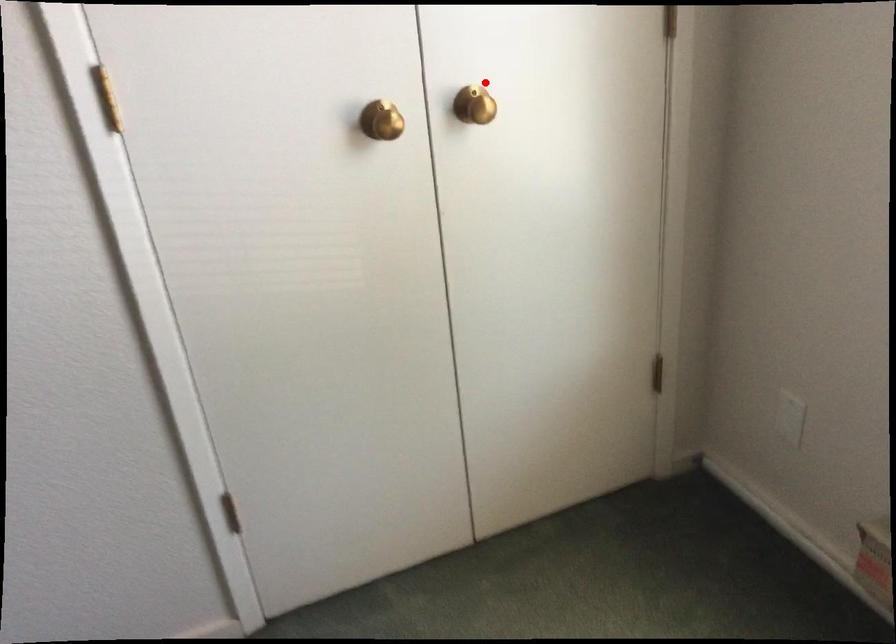
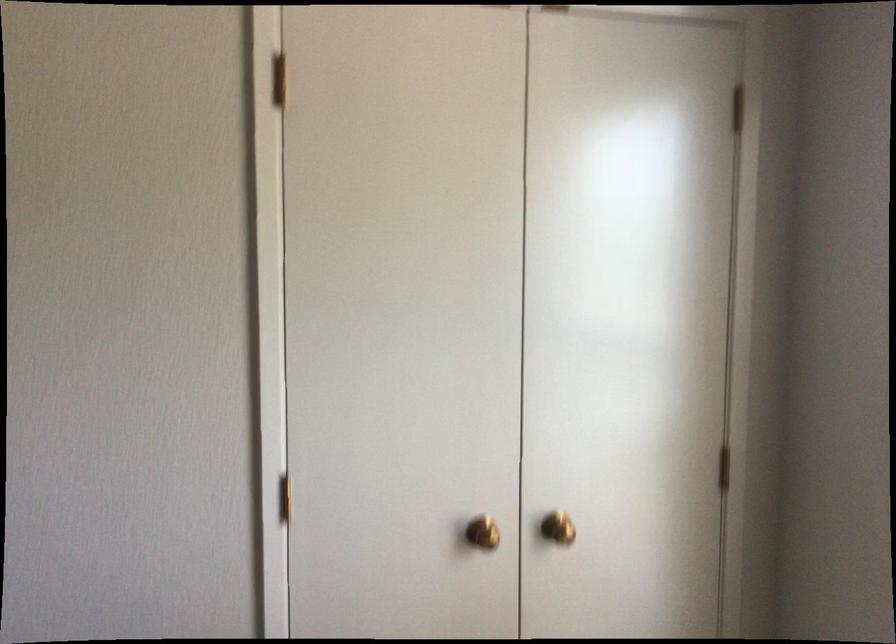
Question: I am providing you with two images of the same scene from different viewpoints. Image1 has a red point marked. In image2, the corresponding 3D location appears at what relative position? Reply with the corresponding letter.

Choices:
 (A) Closer
 (B) Farther

Answer: (B)